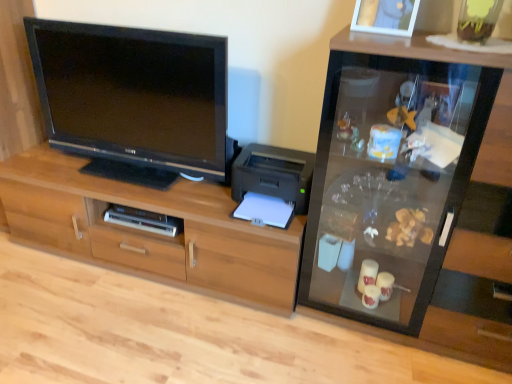
Locate an element on the screen. free point below black glossy tv at left (from a real-world perspective) is located at coordinates (132, 173).